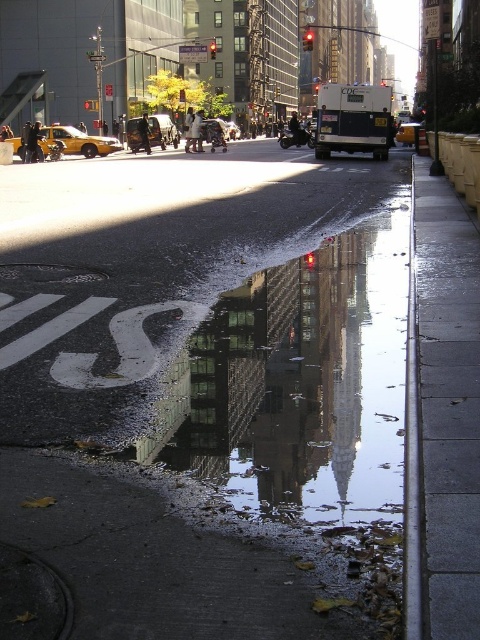
Is metallic silver van at center wider than yellow rubber taxi at center?

Indeed, metallic silver van at center has a greater width compared to yellow rubber taxi at center.

You are a GUI agent. You are given a task and a screenshot of the screen. Output one action in this format:
    pyautogui.click(x=<x>, y=<y>)
    Task: Click on the metallic silver van at center
    This screenshot has width=480, height=640.
    Given the screenshot: What is the action you would take?
    pyautogui.click(x=162, y=131)

How far apart are reflective glass building at center and yellow rubber taxi at left?

reflective glass building at center and yellow rubber taxi at left are 122.36 feet apart.

Between point (397, 486) and point (17, 150), which one is positioned behind?

Positioned behind is point (17, 150).

The height and width of the screenshot is (640, 480). What do you see at coordinates (301, 385) in the screenshot?
I see `reflective glass building at center` at bounding box center [301, 385].

Where is `reflective glass building at center`? This screenshot has height=640, width=480. reflective glass building at center is located at coordinates (301, 385).

What do you see at coordinates (78, 141) in the screenshot? I see `yellow rubber taxi at left` at bounding box center [78, 141].

Between yellow rubber taxi at left and metallic silver van at center, which one has more height?

With more height is metallic silver van at center.

This screenshot has height=640, width=480. In order to click on yellow rubber taxi at left in this screenshot , I will do `click(78, 141)`.